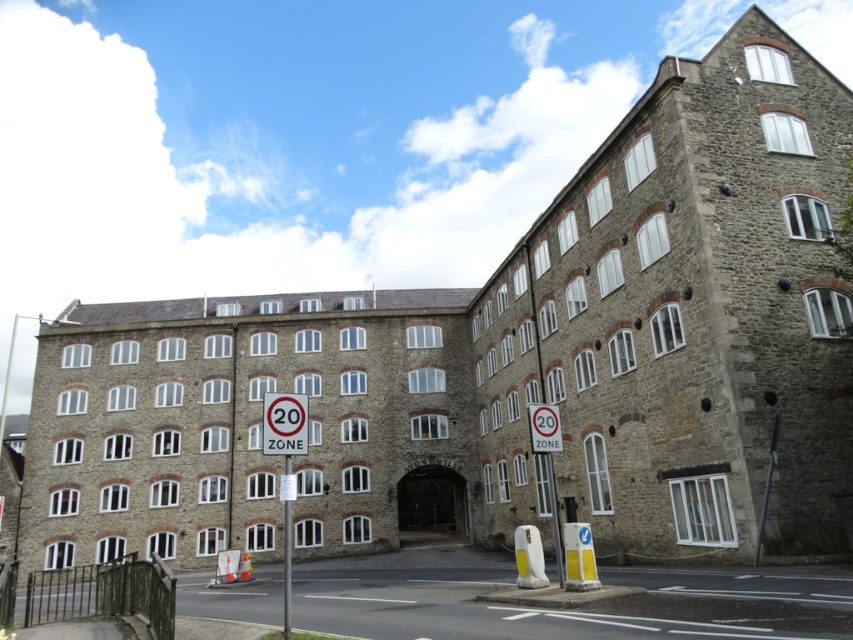
Which of these two, red plastic sign at center or white plastic pole at lower center, stands taller?

white plastic pole at lower center

Does point (277, 440) come closer to viewer compared to point (283, 513)?

Yes.

Locate an element on the screen. The width and height of the screenshot is (853, 640). red plastic sign at center is located at coordinates (283, 422).

Does red plastic sign at center appear on the left side of metallic silver sign at center?

Yes, red plastic sign at center is to the left of metallic silver sign at center.

Is red plastic sign at center further to the viewer compared to metallic silver sign at center?

That is False.

Is point (264, 403) positioned after point (532, 422)?

Yes, it is behind point (532, 422).

The width and height of the screenshot is (853, 640). Find the location of `red plastic sign at center`. red plastic sign at center is located at coordinates (283, 422).

Can you confirm if metallic silver sign at center is positioned above white plastic pole at lower center?

Yes.

Is metallic silver sign at center wider than white plastic pole at lower center?

In fact, metallic silver sign at center might be narrower than white plastic pole at lower center.

Who is more distant from viewer, (553, 436) or (283, 545)?

Positioned behind is point (283, 545).

At what (x,y) coordinates should I click in order to perform the action: click on metallic silver sign at center. Please return your answer as a coordinate pair (x, y). Looking at the image, I should click on (544, 428).